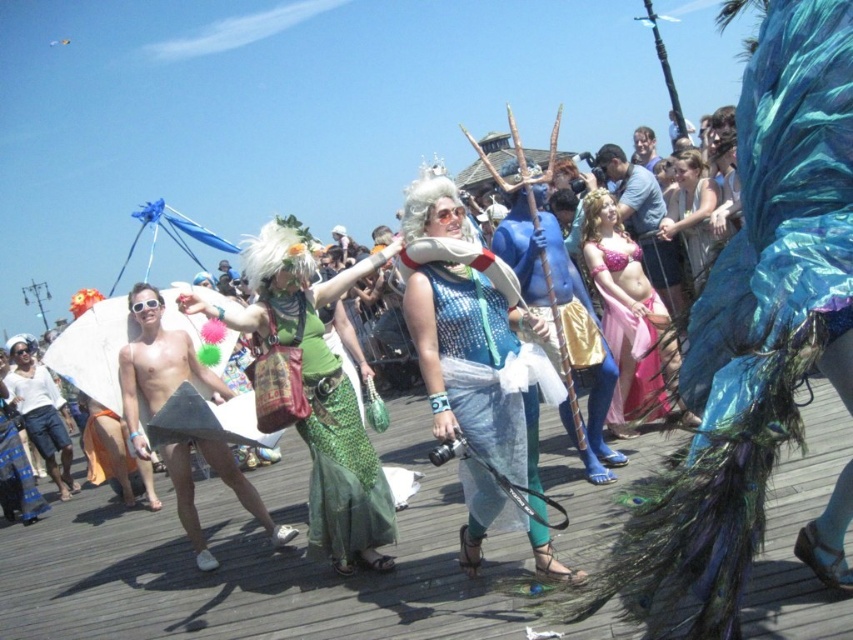
You are a photographer at the beachside event. You want to capture a photo that includes both the green sequined skirt at center and the shiny blue fabric at center. Which object should you focus on first to ensure both are in frame?

The green sequined skirt at center is smaller in size compared to the shiny blue fabric at center. To ensure both are in frame, focus on the larger object first, which is the shiny blue fabric at center, then adjust to include the smaller green sequined skirt at center.

You are standing on the boardwalk and want to take a photo of both the point at coordinates (306,248) and the point at coordinates (331,540). Which point should you position closer to the camera to ensure both are in the frame?

You should position the point at coordinates (331,540) closer to the camera because it is in front of the other point. This way, both points will be visible in the frame.